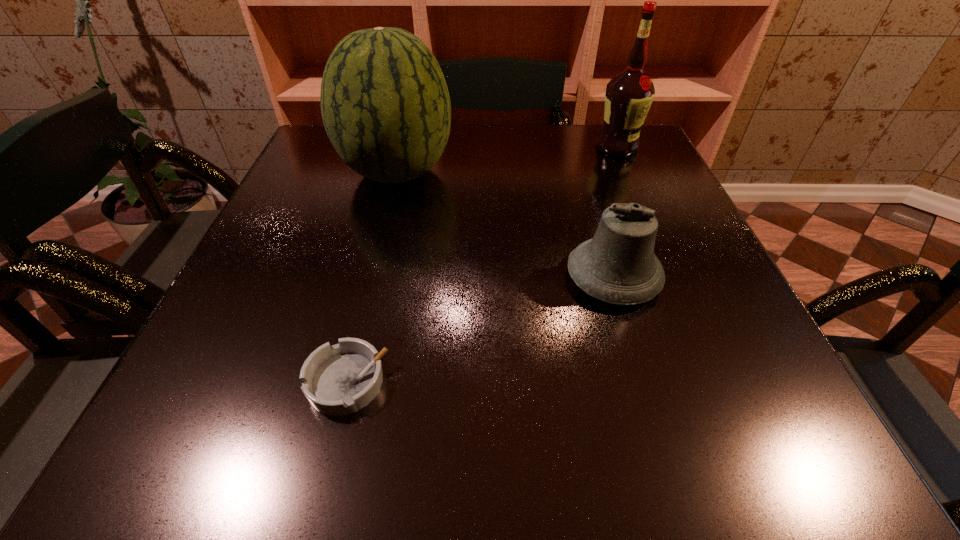
Find the location of a particular element. vacant space that's between the alcohol and the watermelon is located at coordinates (507, 159).

Image resolution: width=960 pixels, height=540 pixels. What are the coordinates of `empty space that is in between the watermelon and the shortest object` in the screenshot? It's located at (372, 276).

Where is `object that can be found as the second closest to the shortest object`? object that can be found as the second closest to the shortest object is located at coordinates (385, 105).

Select which object appears as the third closest to the ashtray. Please provide its 2D coordinates. Your answer should be formatted as a tuple, i.e. [(x, y)], where the tuple contains the x and y coordinates of a point satisfying the conditions above.

[(629, 95)]